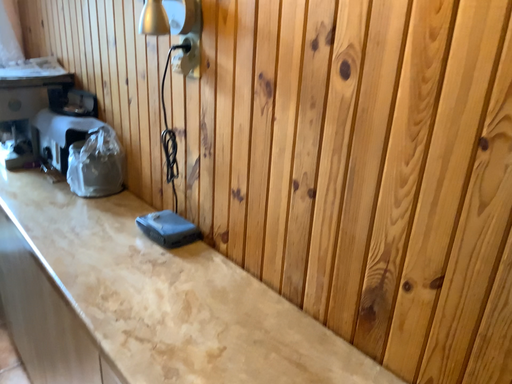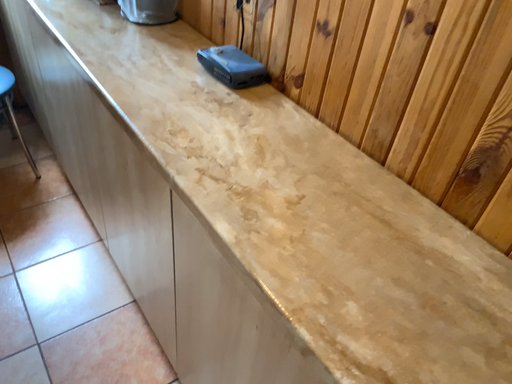
Question: Which way did the camera rotate in the video?

Choices:
 (A) rotated downward
 (B) rotated upward

Answer: (A)